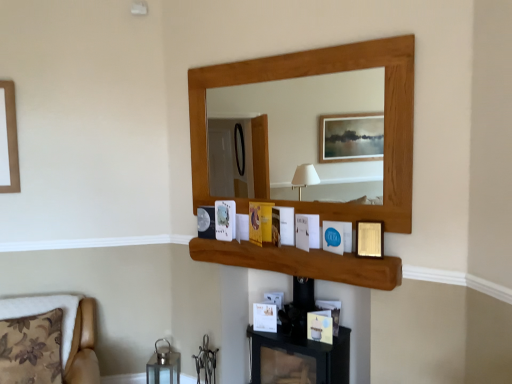
Question: Does point (375, 256) appear closer or farther from the camera than point (310, 314)?

Choices:
 (A) closer
 (B) farther

Answer: (A)

Question: From the image's perspective, relative to matte gold picture frame at center, the 3th picture frame in the right-to-left sequence, is gold metallic picture frame at upper center, placed as the fifth picture frame when sorted from back to front, above or below?

Choices:
 (A) below
 (B) above

Answer: (B)

Question: Considering the real-world distances, which object is closest to the metallic glass lantern at lower left?

Choices:
 (A) metallic silver picture frame at lower left, acting as the first picture frame starting from the left
 (B) gold metallic picture frame at upper center, arranged as the 1th picture frame when viewed from the right
 (C) floral fabric cushion at lower left
 (D) matte gold picture frame at center, positioned as the 1th picture frame in bottom-to-top order
 (E) wooden shelf at center

Answer: (C)

Question: Which object is the farthest from the floral fabric cushion at lower left?

Choices:
 (A) blue paper at center, which is counted as the 3th picture frame, starting from the bottom
 (B) gold metallic picture frame at upper center, which is the 1th picture frame in front-to-back order
 (C) white paper at center, which appears as the fourth picture frame when viewed from the front
 (D) matte gold picture frame at center, the 3th picture frame in the right-to-left sequence
 (E) metallic glass lantern at lower left

Answer: (B)